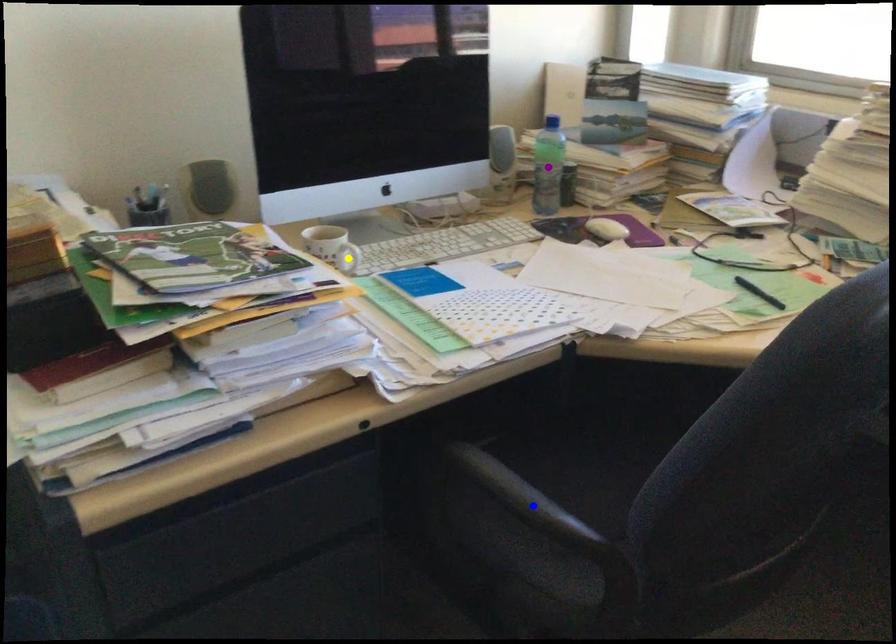
Order these from nearest to farthest:
A) blue point
B) yellow point
C) purple point

1. blue point
2. yellow point
3. purple point